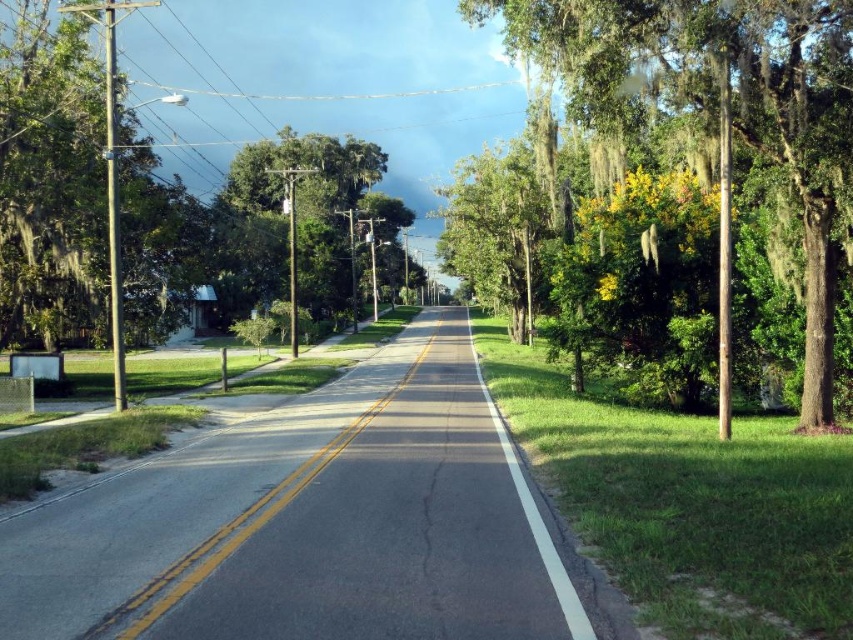
Question: Does green leafy tree at right have a lesser width compared to green leafy tree at center?

Choices:
 (A) yes
 (B) no

Answer: (A)

Question: Which object appears closest to the camera in this image?

Choices:
 (A) green leafy tree at center
 (B) green leafy tree at right

Answer: (B)

Question: Is green leafy tree at right further to camera compared to green leafy tree at center?

Choices:
 (A) yes
 (B) no

Answer: (B)

Question: Is green leafy tree at right bigger than green leafy tree at center?

Choices:
 (A) yes
 (B) no

Answer: (B)